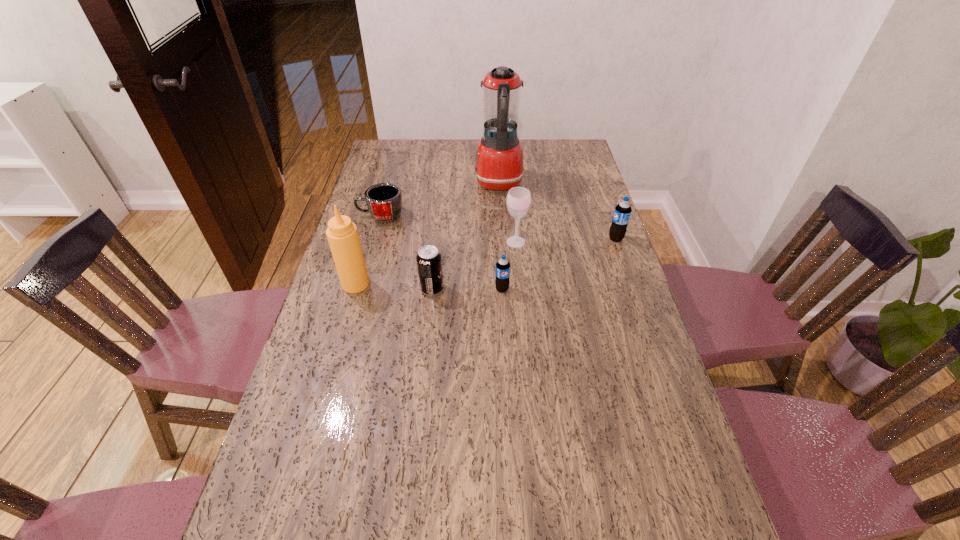
Locate an element on the screen. object that is positioned at the right edge is located at coordinates (622, 212).

Identify the location of free location at the far edge. This screenshot has width=960, height=540. (430, 153).

The height and width of the screenshot is (540, 960). In order to click on free space at the near edge of the desktop in this screenshot , I will do `click(382, 505)`.

In the image, there is a desktop. Where is `free space at the left edge`? free space at the left edge is located at coordinates (336, 299).

Where is `free region at the right edge`? The height and width of the screenshot is (540, 960). free region at the right edge is located at coordinates (602, 307).

Locate an element on the screen. blank space at the far right corner of the desktop is located at coordinates (574, 166).

Where is `vacant area that lies between the fifth object from right to left and the second soda can from right to left`? vacant area that lies between the fifth object from right to left and the second soda can from right to left is located at coordinates (467, 289).

Where is `empty location between the third tallest object and the farthest soda can`? empty location between the third tallest object and the farthest soda can is located at coordinates (565, 240).

This screenshot has width=960, height=540. In order to click on vacant region between the condiment and the tallest object in this screenshot , I will do `click(427, 233)`.

The height and width of the screenshot is (540, 960). In order to click on free space between the leftmost soda can and the food processor in this screenshot , I will do `click(466, 236)`.